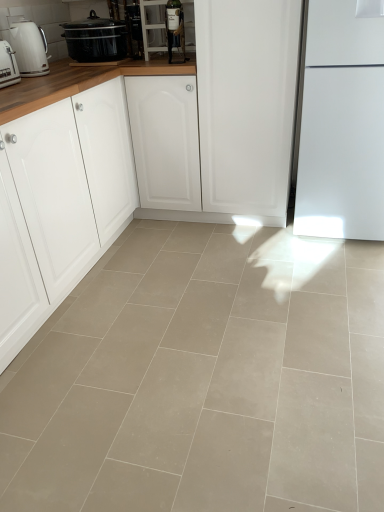
Question: Does point (46, 61) appear closer or farther from the camera than point (104, 152)?

Choices:
 (A) closer
 (B) farther

Answer: (B)

Question: Which is correct: white glossy kettle at left, the 1th kitchen appliance from the back, is inside white matte cabinet at left, or outside of it?

Choices:
 (A) inside
 (B) outside

Answer: (B)

Question: Which of these objects is positioned closest to the matte glass wine bottle at upper center, placed as the 1th appliance when sorted from right to left?

Choices:
 (A) matte black slow cooker at upper left
 (B) white plastic toaster at left, placed as the 2th kitchen appliance when sorted from back to front
 (C) white glossy kettle at left, arranged as the second kitchen appliance when viewed from the front
 (D) metallic glass bottle at upper center, the 2th appliance when ordered from right to left
 (E) beige tile floor at center

Answer: (A)

Question: Which object is the closest to the matte black slow cooker at upper left?

Choices:
 (A) metallic glass bottle at upper center, the 1th appliance when ordered from left to right
 (B) beige tile floor at center
 (C) white plastic toaster at left, placed as the 2th kitchen appliance when sorted from back to front
 (D) matte glass wine bottle at upper center, the first appliance viewed from the front
 (E) white matte cabinet at left

Answer: (A)